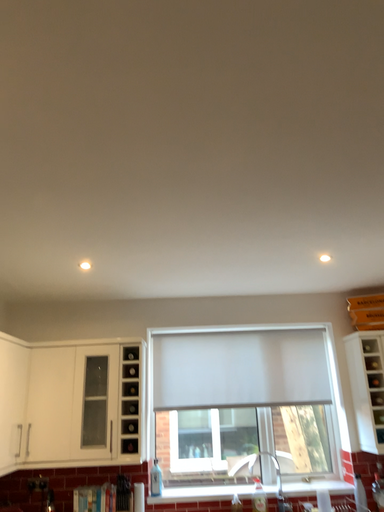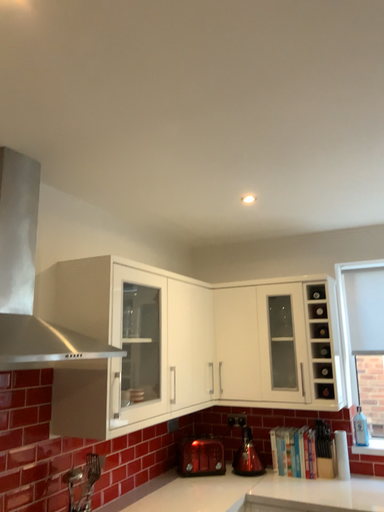
Question: How did the camera likely rotate when shooting the video?

Choices:
 (A) rotated right
 (B) rotated left

Answer: (B)